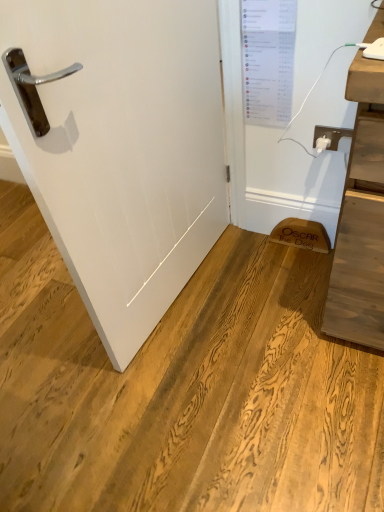
What do you see at coordinates (331, 135) in the screenshot? I see `white plastic plug at upper right` at bounding box center [331, 135].

Measure the distance between point (318,135) and camera.

Point (318,135) and camera are 4.74 feet apart.

What are the coordinates of `white plastic plug at upper right` in the screenshot? It's located at (331, 135).

Describe the element at coordinates (123, 149) in the screenshot. Image resolution: width=384 pixels, height=512 pixels. I see `white matte door at center` at that location.

Where is `white matte door at center`? The width and height of the screenshot is (384, 512). white matte door at center is located at coordinates (123, 149).

At what (x,y) coordinates should I click in order to perform the action: click on white plastic plug at upper right. Please return your answer as a coordinate pair (x, y). This screenshot has height=512, width=384. Looking at the image, I should click on (331, 135).

Which object is positioned more to the left, white plastic plug at upper right or white matte door at center?

white matte door at center is more to the left.

Looking at this image, which is behind, white plastic plug at upper right or white matte door at center?

white plastic plug at upper right is further away from the camera.

Which is behind, point (345, 129) or point (173, 186)?

The point (345, 129) is farther.

From the image's perspective, would you say white plastic plug at upper right is positioned over white matte door at center?

Yes, from the image's perspective, white plastic plug at upper right is on top of white matte door at center.

From a real-world perspective, is white plastic plug at upper right physically above white matte door at center?

Result: No, from a real-world perspective, white plastic plug at upper right is not above white matte door at center.

Is white plastic plug at upper right wider than white matte door at center?

No.

From their relative heights in the image, would you say white plastic plug at upper right is taller or shorter than white matte door at center?

In the image, white plastic plug at upper right appears to be shorter than white matte door at center.

Considering the sizes of objects white plastic plug at upper right and white matte door at center in the image provided, who is smaller, white plastic plug at upper right or white matte door at center?

With smaller size is white plastic plug at upper right.

Which is correct: white plastic plug at upper right is inside white matte door at center, or outside of it?

white plastic plug at upper right is spatially situated outside white matte door at center.

Is white plastic plug at upper right not close to white matte door at center?

white plastic plug at upper right is near white matte door at center, not far away.

Could you tell me if white plastic plug at upper right is turned towards white matte door at center?

No, white plastic plug at upper right is not aimed at white matte door at center.

Locate an element on the screen. This screenshot has height=512, width=384. electric outlet located on the right of white matte door at center is located at coordinates (331, 135).

Does white matte door at center appear on the left side of white plastic plug at upper right?

Yes.

Between white matte door at center and white plastic plug at upper right, which one is positioned behind?

white plastic plug at upper right is further away from the camera.

Looking at this image, which is further, [15,23] or [326,131]?

Positioned behind is point [326,131].

Looking at this image, from the image's perspective, which is below, white matte door at center or white plastic plug at upper right?

white matte door at center is shown below in the image.

From a real-world perspective, is white matte door at center physically above white plastic plug at upper right?

Correct, in the physical world, white matte door at center is higher than white plastic plug at upper right.

Considering the relative sizes of white matte door at center and white plastic plug at upper right in the image provided, is white matte door at center wider than white plastic plug at upper right?

Indeed, white matte door at center has a greater width compared to white plastic plug at upper right.

Does white matte door at center have a lesser height compared to white plastic plug at upper right?

In fact, white matte door at center may be taller than white plastic plug at upper right.

Who is smaller, white matte door at center or white plastic plug at upper right?

Smaller between the two is white plastic plug at upper right.

Is white matte door at center situated inside white plastic plug at upper right or outside?

white matte door at center exists outside the volume of white plastic plug at upper right.

Is white matte door at center not near white plastic plug at upper right?

No.

Is white matte door at center facing away from white plastic plug at upper right?

No, white matte door at center is not facing away from white plastic plug at upper right.

How many degrees apart are the facing directions of white matte door at center and white plastic plug at upper right?

84.7 degrees.

This screenshot has height=512, width=384. Identify the location of door to the left of white plastic plug at upper right. (123, 149).

Where is `door above the white plastic plug at upper right (from a real-world perspective)`? The image size is (384, 512). door above the white plastic plug at upper right (from a real-world perspective) is located at coordinates [x=123, y=149].

I want to click on door lying in front of the white plastic plug at upper right, so click(x=123, y=149).